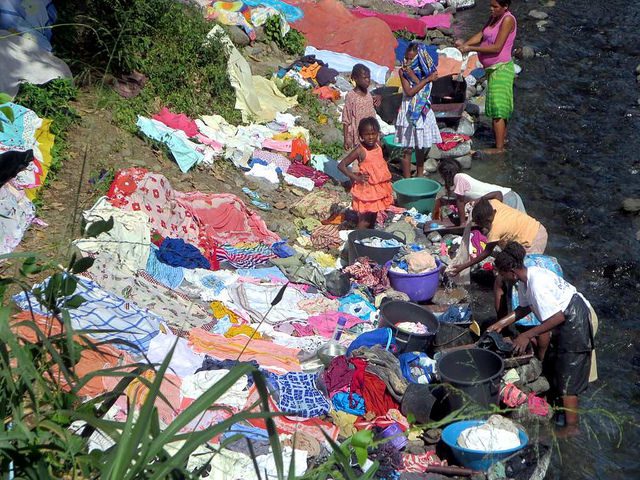
Locate an element on the screen. This screenshot has height=480, width=640. washing bins is located at coordinates (481, 366), (461, 443), (417, 315), (420, 290), (371, 241), (404, 187), (388, 139).